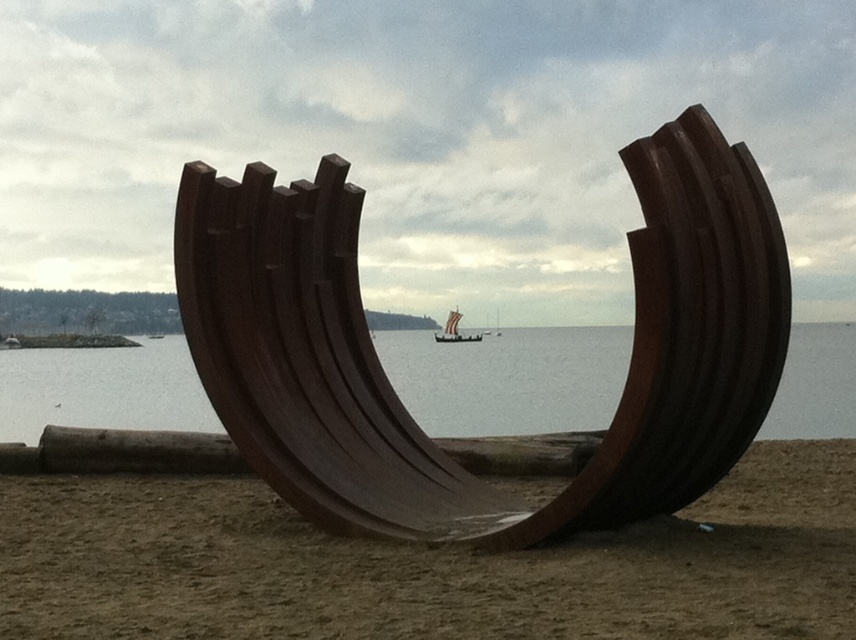
Question: Which object is closer to the camera taking this photo?

Choices:
 (A) rusty metal sculpture at center
 (B) rustic wood sculpture at center
 (C) wooden viking ship at center
 (D) brown wooden water at center

Answer: (D)

Question: Is rustic wood sculpture at center bigger than wooden viking ship at center?

Choices:
 (A) yes
 (B) no

Answer: (B)

Question: Is rusty metal sculpture at center to the left of wooden viking ship at center from the viewer's perspective?

Choices:
 (A) yes
 (B) no

Answer: (A)

Question: Based on their relative distances, which object is farther from the brown wooden water at center?

Choices:
 (A) wooden viking ship at center
 (B) rustic wood sculpture at center

Answer: (B)

Question: Considering the relative positions of rusty metal sculpture at center and wooden viking ship at center in the image provided, where is rusty metal sculpture at center located with respect to wooden viking ship at center?

Choices:
 (A) below
 (B) above

Answer: (A)

Question: Which object is positioned farthest from the rustic wood sculpture at center?

Choices:
 (A) wooden viking ship at center
 (B) rusty metal sculpture at center

Answer: (A)